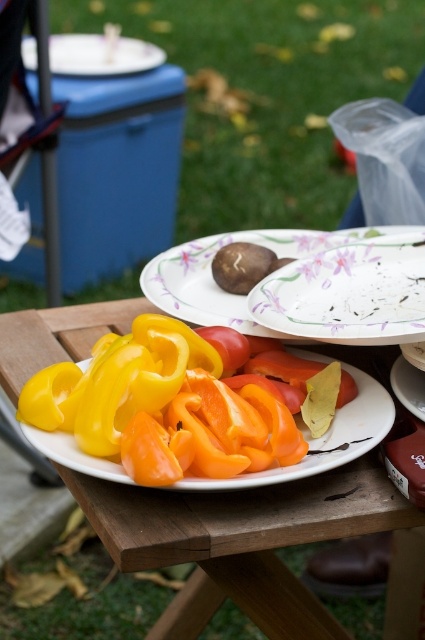
From the picture: You are setting up a picnic table and want to place a small salt shaker between the smooth plastic plate at center and the sliced yellow bell peppers at center. The salt shaker requires at least 5 inches of space to fit. Can you determine if there is enough space between them?

The smooth plastic plate at center is 7.17 inches from sliced yellow bell peppers at center, which is more than the required 5 inches. Therefore, there is enough space to place the salt shaker between them.

You are at a picnic and want to place your drink between the wooden picnic table at center and the brown matte mushroom at center. Which side of the mushroom should you place it on?

The wooden picnic table at center is to the left of the brown matte mushroom at center, so you should place your drink to the right side of the mushroom.